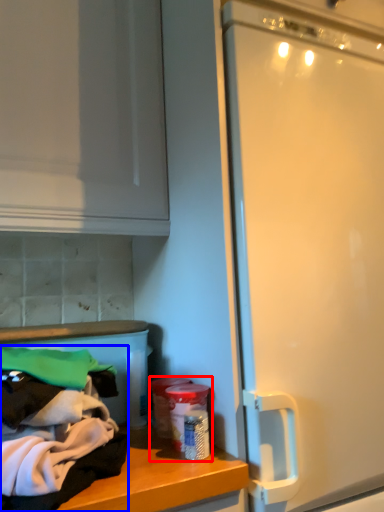
Question: Among these objects, which one is farthest to the camera, garbage (highlighted by a red box) or clothing (highlighted by a blue box)?

Choices:
 (A) garbage
 (B) clothing

Answer: (A)